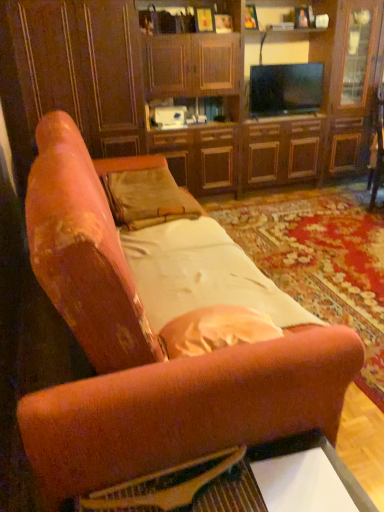
Question: Are flat-screen tv at upper center and suede-like beige pillow at center making contact?

Choices:
 (A) yes
 (B) no

Answer: (B)

Question: From a real-world perspective, is flat-screen tv at upper center physically above suede-like beige pillow at center?

Choices:
 (A) no
 (B) yes

Answer: (B)

Question: From the image's perspective, does flat-screen tv at upper center appear higher than suede-like beige pillow at center?

Choices:
 (A) yes
 (B) no

Answer: (A)

Question: Is flat-screen tv at upper center not inside suede-like beige pillow at center?

Choices:
 (A) no
 (B) yes

Answer: (B)

Question: From a real-world perspective, is flat-screen tv at upper center positioned under suede-like beige pillow at center based on gravity?

Choices:
 (A) no
 (B) yes

Answer: (A)

Question: Can you confirm if flat-screen tv at upper center is wider than suede-like beige pillow at center?

Choices:
 (A) yes
 (B) no

Answer: (B)

Question: Is velvet orange couch at center inside flat-screen tv at upper center?

Choices:
 (A) yes
 (B) no

Answer: (B)

Question: Is flat-screen tv at upper center touching velvet orange couch at center?

Choices:
 (A) no
 (B) yes

Answer: (A)

Question: Is flat-screen tv at upper center not within velvet orange couch at center?

Choices:
 (A) yes
 (B) no

Answer: (A)

Question: Does flat-screen tv at upper center have a greater width compared to velvet orange couch at center?

Choices:
 (A) no
 (B) yes

Answer: (A)

Question: From a real-world perspective, is flat-screen tv at upper center positioned under velvet orange couch at center based on gravity?

Choices:
 (A) no
 (B) yes

Answer: (A)

Question: Is the depth of flat-screen tv at upper center greater than that of velvet orange couch at center?

Choices:
 (A) no
 (B) yes

Answer: (B)

Question: From the image's perspective, is velvet orange couch at center located beneath flat-screen tv at upper center?

Choices:
 (A) yes
 (B) no

Answer: (A)